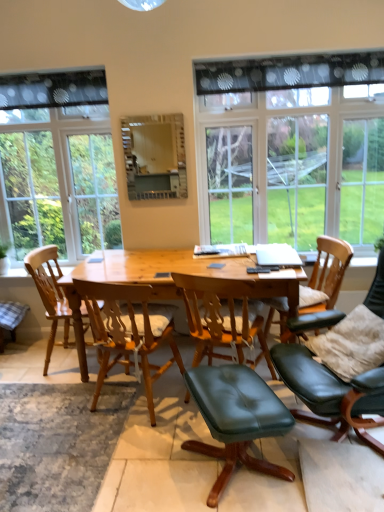
Question: From the image's perspective, is clear glass window at left, the first window in the left-to-right sequence, located beneath black leather chair at right, the 4th chair from the left?

Choices:
 (A) no
 (B) yes

Answer: (A)

Question: Is clear glass window at left, placed as the second window when sorted from right to left, at the left side of black leather chair at right, the 4th chair from the left?

Choices:
 (A) no
 (B) yes

Answer: (B)

Question: Considering the relative sizes of clear glass window at left, the first window in the left-to-right sequence, and black leather chair at right, the 1th chair in the right-to-left sequence, in the image provided, is clear glass window at left, the first window in the left-to-right sequence, wider than black leather chair at right, the 1th chair in the right-to-left sequence,?

Choices:
 (A) yes
 (B) no

Answer: (B)

Question: Does clear glass window at left, the first window in the left-to-right sequence, have a lesser height compared to black leather chair at right, the 4th chair from the left?

Choices:
 (A) no
 (B) yes

Answer: (A)

Question: From the image's perspective, is clear glass window at left, the first window in the left-to-right sequence, located above black leather chair at right, the 4th chair from the left?

Choices:
 (A) yes
 (B) no

Answer: (A)

Question: Is wooden chair at center, the third chair in the right-to-left sequence, inside or outside of leather cushioned chair at center, the third chair viewed from the left?

Choices:
 (A) inside
 (B) outside

Answer: (B)

Question: Considering their positions, is wooden chair at center, the second chair in the left-to-right sequence, located in front of or behind leather cushioned chair at center, which ranks as the 2th chair in right-to-left order?

Choices:
 (A) front
 (B) behind

Answer: (A)

Question: In terms of size, does wooden chair at center, the third chair in the right-to-left sequence, appear bigger or smaller than leather cushioned chair at center, which ranks as the 2th chair in right-to-left order?

Choices:
 (A) big
 (B) small

Answer: (B)

Question: From a real-world perspective, is wooden chair at center, the third chair in the right-to-left sequence, physically located above or below leather cushioned chair at center, the third chair viewed from the left?

Choices:
 (A) above
 (B) below

Answer: (A)

Question: Is point (364, 403) closer or farther from the camera than point (196, 329)?

Choices:
 (A) closer
 (B) farther

Answer: (A)

Question: In the image, is black leather chair at right, the 4th chair from the left, on the left side or the right side of leather cushioned chair at center, which ranks as the 2th chair in right-to-left order?

Choices:
 (A) right
 (B) left

Answer: (A)

Question: Relative to leather cushioned chair at center, the third chair viewed from the left, is black leather chair at right, the 4th chair from the left, in front or behind?

Choices:
 (A) front
 (B) behind

Answer: (A)

Question: From their relative heights in the image, would you say black leather chair at right, the 1th chair in the right-to-left sequence, is taller or shorter than leather cushioned chair at center, which ranks as the 2th chair in right-to-left order?

Choices:
 (A) tall
 (B) short

Answer: (A)

Question: Is natural wood table at center bigger or smaller than black leather chair at right, the 4th chair from the left?

Choices:
 (A) big
 (B) small

Answer: (A)

Question: Visually, is natural wood table at center positioned to the left or to the right of black leather chair at right, the 4th chair from the left?

Choices:
 (A) right
 (B) left

Answer: (B)